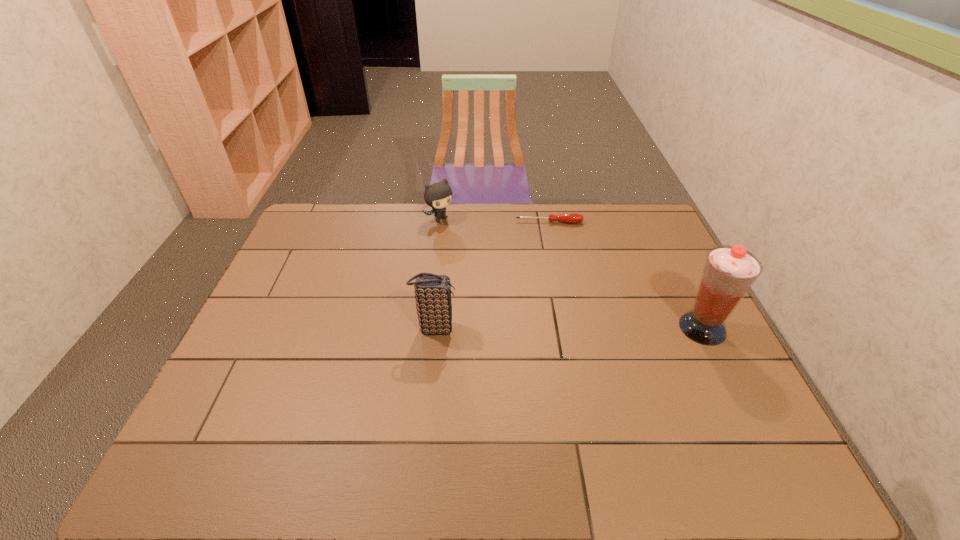
The height and width of the screenshot is (540, 960). I want to click on clutch bag, so click(x=433, y=292).

This screenshot has height=540, width=960. I want to click on the rightmost object, so click(729, 272).

Locate an element on the screen. The width and height of the screenshot is (960, 540). smoothie is located at coordinates (729, 272).

The image size is (960, 540). I want to click on the second shortest object, so click(438, 195).

Find the location of a particular element. the third object from left to right is located at coordinates (569, 217).

Where is `screwdriver`? This screenshot has width=960, height=540. screwdriver is located at coordinates (569, 217).

This screenshot has height=540, width=960. Identify the location of free spot located 0.350m with the zip open on the second tallest object. (585, 328).

This screenshot has width=960, height=540. I want to click on vacant region located on the back of the rightmost object, so click(x=670, y=262).

Identify the location of free space located on the front-facing side of the third tallest object. (490, 262).

What are the coordinates of `vacant space located 0.140m on the front-facing side of the third tallest object` in the screenshot? It's located at (472, 246).